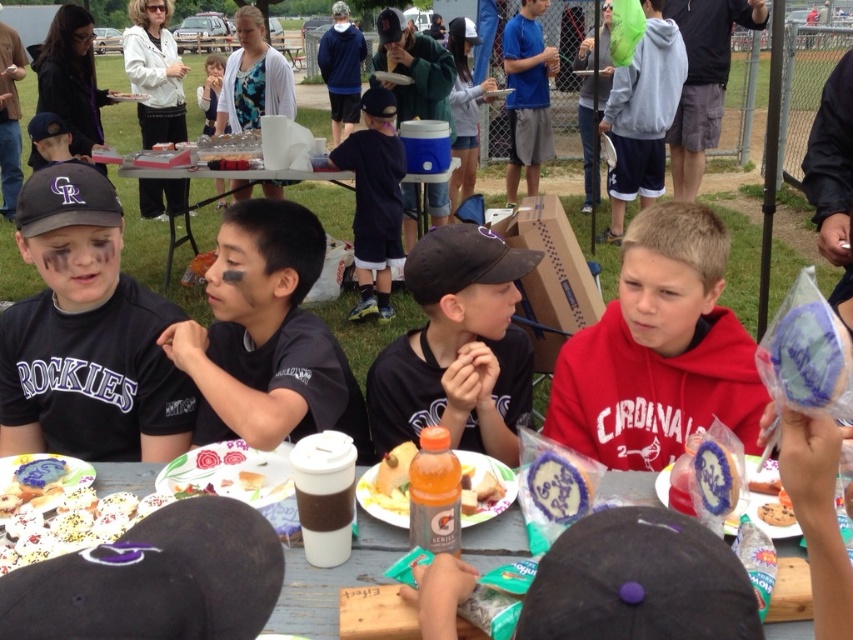
You are a photographer at the event and want to capture a photo of the white plastic table at center without the black matte baseball cap at left being in the frame. Which direction should you move your camera to achieve this?

The black matte baseball cap at left is positioned on the right side of the white plastic table at center. To exclude the cap from the frame, move the camera to the right side of the table so that the cap is out of view.

You are a photographer standing at the edge of the field. You want to take a photo of the white plastic table at center and the black matte baseball cap at left. Which object should you focus on first to ensure both are in sharp focus?

The black matte baseball cap at left is closer to the viewer than the white plastic table at center. To ensure both are in sharp focus, focus on the closer object first, which is the black matte baseball cap at left.